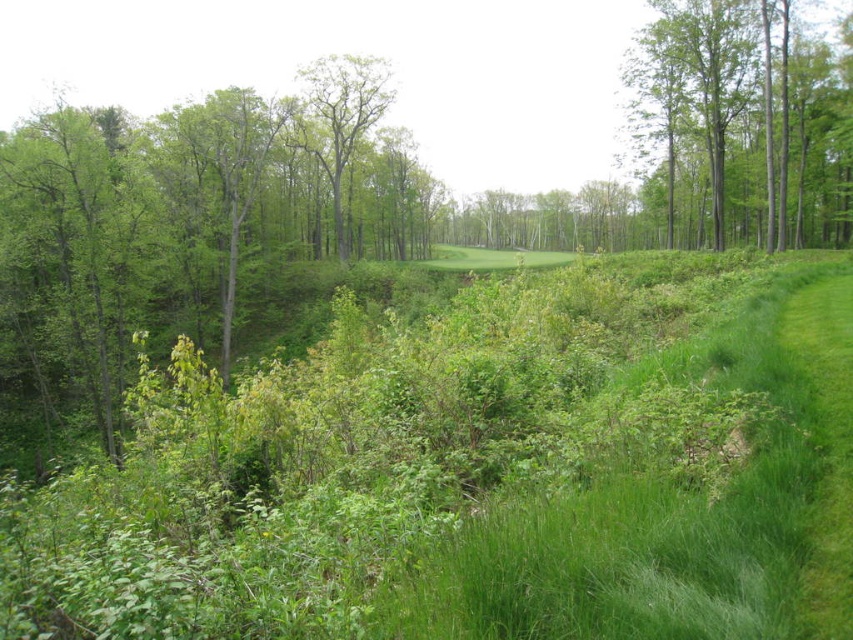
You are a hiker who wants to take a photo of both the green smooth tree at upper right and the green leafy tree at center. Which tree should you stand closer to in order to capture both in the same frame?

You should stand closer to the green leafy tree at center because it is smaller than the green smooth tree at upper right, allowing both trees to fit within the camera frame.

You are standing at the edge of the dense vegetation in the foreground of the image. You want to walk to the green grass at center. Based on the 2D coordinates provided, in which general direction should you head?

The green grass at center is located at coordinates point (456, 474). Since you are at the edge of the dense vegetation in the foreground, which is likely the lower part of the image, you should head towards the center and slightly to the right to reach the green grass at center.

You are a gardener who needs to mow the lawn. You see the green grass at center and the green leafy tree at center. Which one should you mow?

You should mow the green grass at center because it is not as tall as the green leafy tree at center, and trees are typically not mowed.